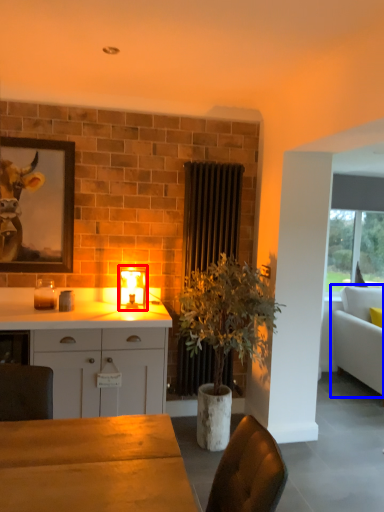
Question: Among these objects, which one is farthest to the camera, lamp (highlighted by a red box) or studio couch (highlighted by a blue box)?

Choices:
 (A) lamp
 (B) studio couch

Answer: (B)